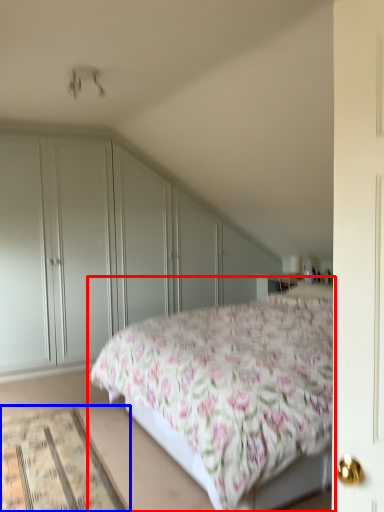
Question: Which object appears closest to the camera in this image, bed (highlighted by a red box) or mat (highlighted by a blue box)?

Choices:
 (A) bed
 (B) mat

Answer: (A)